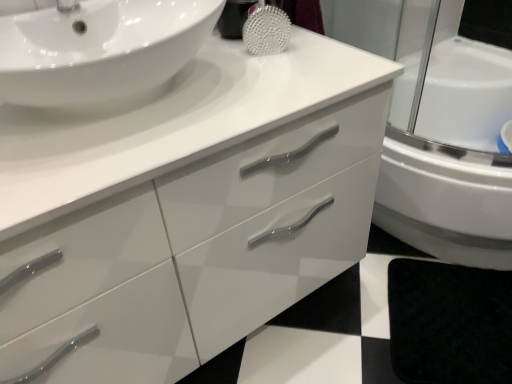
Question: Is white glossy sink at upper left oriented towards black matte bath mat at lower right?

Choices:
 (A) yes
 (B) no

Answer: (B)

Question: Is white glossy sink at upper left behind black matte bath mat at lower right?

Choices:
 (A) yes
 (B) no

Answer: (B)

Question: Is white glossy sink at upper left not inside black matte bath mat at lower right?

Choices:
 (A) yes
 (B) no

Answer: (A)

Question: Can you confirm if white glossy sink at upper left is positioned to the left of black matte bath mat at lower right?

Choices:
 (A) yes
 (B) no

Answer: (A)

Question: Does white glossy sink at upper left have a lesser width compared to black matte bath mat at lower right?

Choices:
 (A) yes
 (B) no

Answer: (A)

Question: From the image's perspective, does white glossy sink at upper left appear higher than black matte bath mat at lower right?

Choices:
 (A) no
 (B) yes

Answer: (B)

Question: Is black matte bath mat at lower right taller than glossy white cabinet at center?

Choices:
 (A) no
 (B) yes

Answer: (A)

Question: Does black matte bath mat at lower right have a lesser height compared to glossy white cabinet at center?

Choices:
 (A) no
 (B) yes

Answer: (B)

Question: Can you confirm if black matte bath mat at lower right is smaller than glossy white cabinet at center?

Choices:
 (A) yes
 (B) no

Answer: (A)

Question: Considering the relative sizes of black matte bath mat at lower right and glossy white cabinet at center in the image provided, is black matte bath mat at lower right wider than glossy white cabinet at center?

Choices:
 (A) yes
 (B) no

Answer: (B)

Question: Considering the relative positions of black matte bath mat at lower right and glossy white cabinet at center in the image provided, is black matte bath mat at lower right behind glossy white cabinet at center?

Choices:
 (A) yes
 (B) no

Answer: (A)

Question: Considering the relative positions of black matte bath mat at lower right and glossy white cabinet at center in the image provided, is black matte bath mat at lower right to the right of glossy white cabinet at center from the viewer's perspective?

Choices:
 (A) no
 (B) yes

Answer: (B)

Question: Does glossy white cabinet at center have a larger size compared to black matte bath mat at lower right?

Choices:
 (A) yes
 (B) no

Answer: (A)